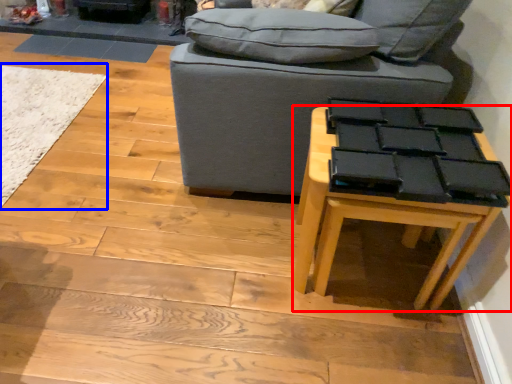
Question: Among these objects, which one is farthest to the camera, table (highlighted by a red box) or mat (highlighted by a blue box)?

Choices:
 (A) table
 (B) mat

Answer: (B)